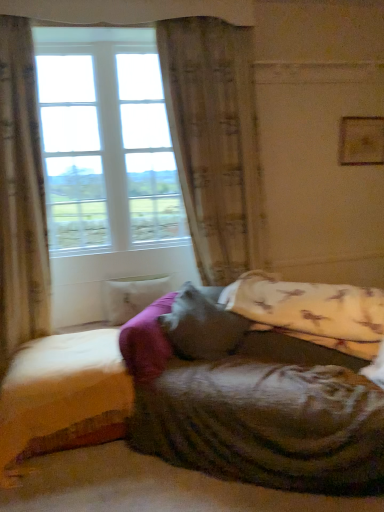
Question: Is wooden bed frame at lower left bigger or smaller than beige textured curtain at left, placed as the second curtain when sorted from right to left?

Choices:
 (A) big
 (B) small

Answer: (B)

Question: Is wooden bed frame at lower left wider or thinner than beige textured curtain at left, placed as the second curtain when sorted from right to left?

Choices:
 (A) wide
 (B) thin

Answer: (A)

Question: Which object is the closest to the wooden bed frame at lower left?

Choices:
 (A) white marble pillow at center, which is counted as the second pillow, starting from the front
 (B) beige textured curtain at left, acting as the first curtain starting from the left
 (C) clear glass window at upper left
 (D) beige textured curtain at center, marked as the 1th curtain in a right-to-left arrangement
 (E) velvety gray pillow at center, which is the 2th pillow in left-to-right order

Answer: (E)

Question: Considering the real-world distances, which object is closest to the clear glass window at upper left?

Choices:
 (A) velvety gray pillow at center, the 1th pillow from the front
 (B) beige textured curtain at left, placed as the second curtain when sorted from right to left
 (C) white marble pillow at center, placed as the second pillow when sorted from right to left
 (D) wooden bed frame at lower left
 (E) beige textured curtain at center, marked as the 1th curtain in a right-to-left arrangement

Answer: (B)